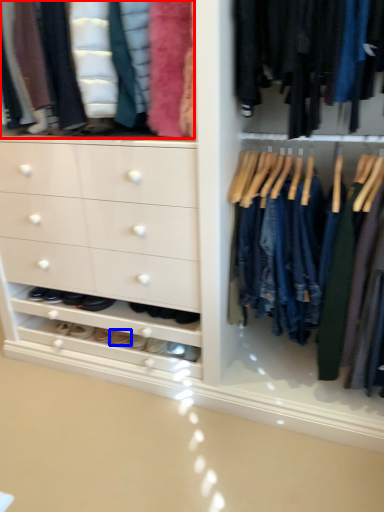
Question: Which of the following is the farthest to the observer, clothing (highlighted by a red box) or footwear (highlighted by a blue box)?

Choices:
 (A) clothing
 (B) footwear

Answer: (B)